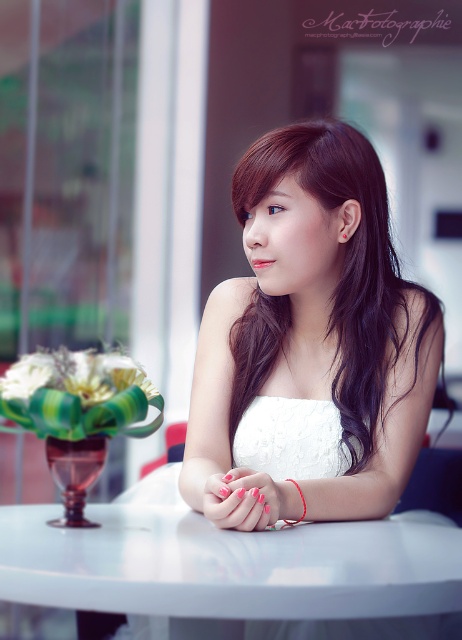
Who is taller, white glossy table at center or red string bracelet at center?

With more height is red string bracelet at center.

Is point (326, 570) positioned after point (296, 484)?

No.

Where is `white glossy table at center`? The width and height of the screenshot is (462, 640). white glossy table at center is located at coordinates (228, 564).

Is point (425, 595) positioned after point (249, 330)?

No, it is not.

Based on the photo, is white glossy table at center smaller than brown silky hair at center?

Correct, white glossy table at center occupies less space than brown silky hair at center.

The height and width of the screenshot is (640, 462). I want to click on white glossy table at center, so click(228, 564).

You are a GUI agent. You are given a task and a screenshot of the screen. Output one action in this format:
    pyautogui.click(x=<x>, y=<y>)
    Task: Click on the white glossy table at center
    
    Given the screenshot: What is the action you would take?
    pyautogui.click(x=228, y=564)

Is brown silky hair at center positioned in front of pink matte nails at center?

No.

Who is positioned more to the left, brown silky hair at center or pink matte nails at center?

Positioned to the left is pink matte nails at center.

Does point (391, 358) come in front of point (271, 497)?

No, (391, 358) is behind (271, 497).

Where is `brown silky hair at center`? The width and height of the screenshot is (462, 640). brown silky hair at center is located at coordinates click(x=346, y=262).